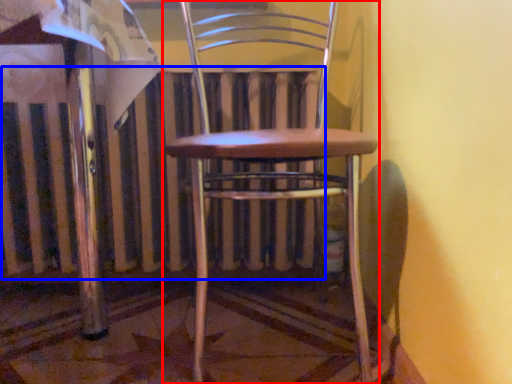
Question: Among these objects, which one is nearest to the camera, chair (highlighted by a red box) or radiator (highlighted by a blue box)?

Choices:
 (A) chair
 (B) radiator

Answer: (A)